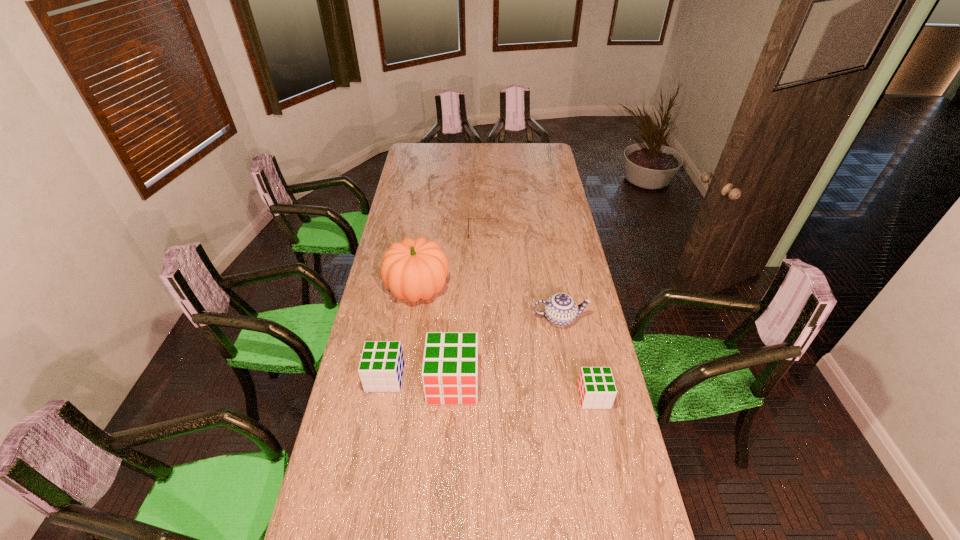
In order to click on the leftmost cube in this screenshot , I will do `click(381, 366)`.

At what (x,y) coordinates should I click in order to perform the action: click on the second tallest object. Please return your answer as a coordinate pair (x, y). The width and height of the screenshot is (960, 540). Looking at the image, I should click on (449, 374).

At what (x,y) coordinates should I click in order to perform the action: click on the second cube from left to right. Please return your answer as a coordinate pair (x, y). The width and height of the screenshot is (960, 540). Looking at the image, I should click on (449, 374).

Image resolution: width=960 pixels, height=540 pixels. I want to click on the shortest cube, so click(596, 386).

Where is `the second shortest object`? the second shortest object is located at coordinates (596, 386).

Find the location of a particular element. the farthest object is located at coordinates (468, 218).

At what (x,y) coordinates should I click in order to perform the action: click on the shortest object. Please return your answer as a coordinate pair (x, y). This screenshot has width=960, height=540. Looking at the image, I should click on (468, 218).

The height and width of the screenshot is (540, 960). Identify the location of chinaware. tap(560, 309).

Where is `the tallest object`? the tallest object is located at coordinates (413, 269).

The height and width of the screenshot is (540, 960). I want to click on vacant space located on the red face of the second cube from left to right, so click(448, 468).